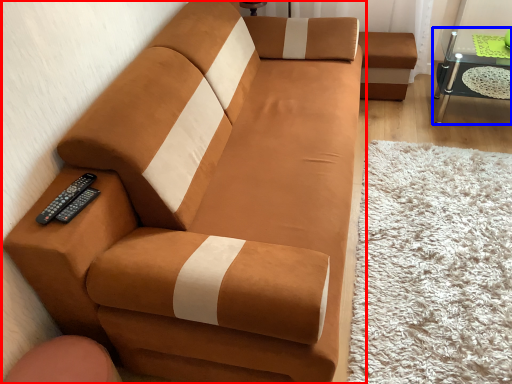
Question: Which of the following is the farthest to the observer, studio couch (highlighted by a red box) or table (highlighted by a blue box)?

Choices:
 (A) studio couch
 (B) table

Answer: (B)